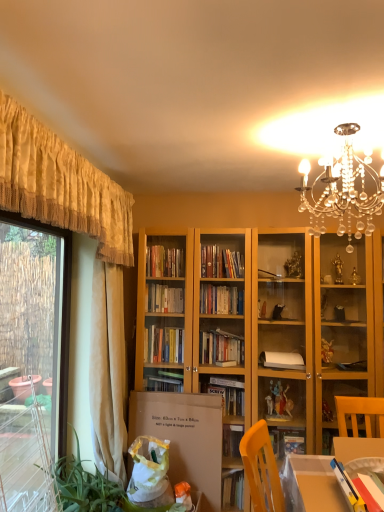
At what (x,y) coordinates should I click in order to perform the action: click on free space above clear crystal chandelier at upper center (from a real-world perspective). Please return your answer as a coordinate pair (x, y). This screenshot has height=512, width=384. Looking at the image, I should click on (337, 125).